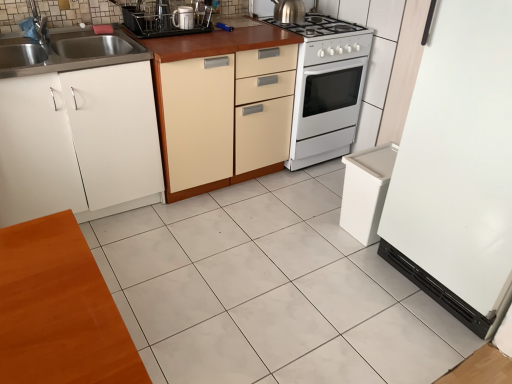
Locate an element on the screen. vacant region above white glossy tile at center (from a real-world perspective) is located at coordinates (295, 274).